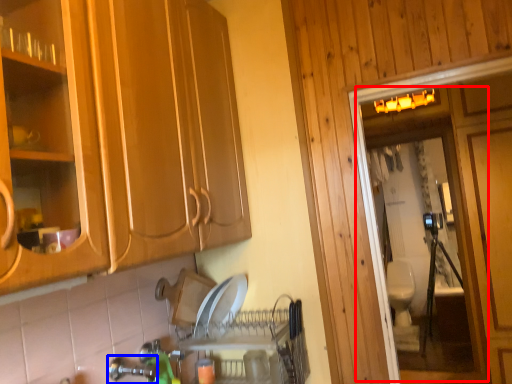
Question: Which object appears closest to the camera in this image, screen door (highlighted by a red box) or faucet (highlighted by a blue box)?

Choices:
 (A) screen door
 (B) faucet

Answer: (B)